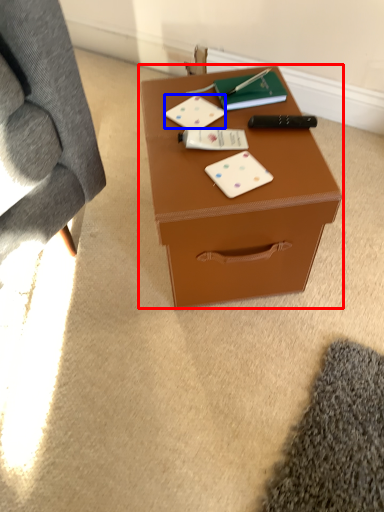
Question: Among these objects, which one is nearest to the camera, table (highlighted by a red box) or card game (highlighted by a blue box)?

Choices:
 (A) table
 (B) card game

Answer: (A)